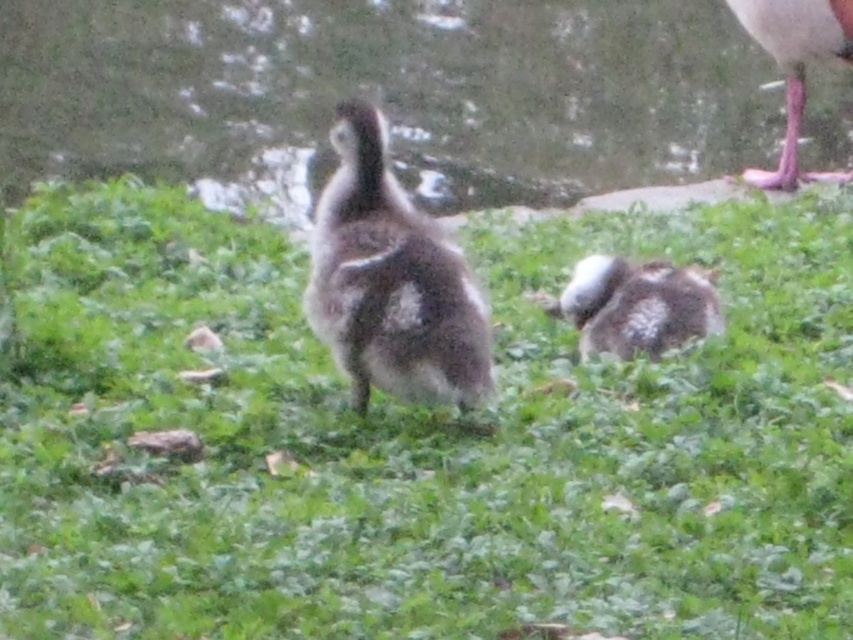
You are a gardener trying to plant a row of flowers between the green fuzzy grass at center and the speckled feathered duckling at center. Can you fit the flowers in between them without overlapping?

The green fuzzy grass at center is wider than the speckled feathered duckling at center, so there is sufficient space to plant flowers between them without overlapping.